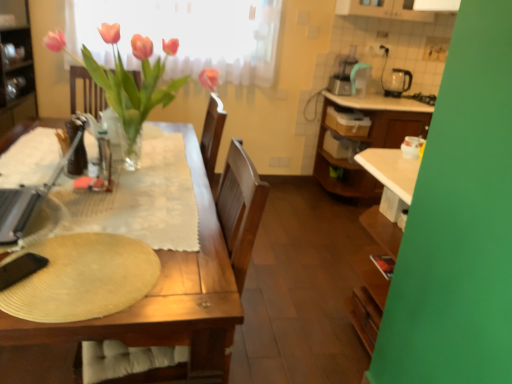
Question: From the image's perspective, is black plastic kettle at upper right, the first appliance positioned from the top, below translucent glass bottle at table left?

Choices:
 (A) yes
 (B) no

Answer: (B)

Question: From a real-world perspective, is black plastic kettle at upper right, which is the 2th appliance in bottom-to-top order, on translucent glass bottle at table left?

Choices:
 (A) yes
 (B) no

Answer: (A)

Question: Considering the relative sizes of black plastic kettle at upper right, arranged as the 1th appliance when viewed from the back, and translucent glass bottle at table left in the image provided, is black plastic kettle at upper right, arranged as the 1th appliance when viewed from the back, bigger than translucent glass bottle at table left?

Choices:
 (A) yes
 (B) no

Answer: (A)

Question: Would you say black plastic kettle at upper right, which is counted as the first appliance, starting from the right, contains translucent glass bottle at table left?

Choices:
 (A) no
 (B) yes

Answer: (A)

Question: Can you confirm if black plastic kettle at upper right, the 2th appliance when ordered from front to back, is thinner than translucent glass bottle at table left?

Choices:
 (A) yes
 (B) no

Answer: (B)

Question: From the image's perspective, would you say black plastic kettle at upper right, the second appliance positioned from the left, is positioned over translucent glass bottle at table left?

Choices:
 (A) no
 (B) yes

Answer: (B)

Question: From a real-world perspective, is translucent glass bottle at table left beneath metallic silver laptop at left, the 2th appliance when ordered from back to front?

Choices:
 (A) no
 (B) yes

Answer: (B)

Question: From a real-world perspective, is translucent glass bottle at table left on top of metallic silver laptop at left, marked as the second appliance in a top-to-bottom arrangement?

Choices:
 (A) no
 (B) yes

Answer: (A)

Question: Is translucent glass bottle at table left far away from metallic silver laptop at left, the first appliance from the bottom?

Choices:
 (A) yes
 (B) no

Answer: (B)

Question: Is the surface of translucent glass bottle at table left in direct contact with metallic silver laptop at left, the 2th appliance when ordered from back to front?

Choices:
 (A) no
 (B) yes

Answer: (A)

Question: Considering the relative sizes of translucent glass bottle at table left and metallic silver laptop at left, which is counted as the 1th appliance, starting from the left, in the image provided, is translucent glass bottle at table left shorter than metallic silver laptop at left, which is counted as the 1th appliance, starting from the left,?

Choices:
 (A) yes
 (B) no

Answer: (A)

Question: Does translucent glass bottle at table left have a greater width compared to metallic silver laptop at left, the first appliance from the bottom?

Choices:
 (A) no
 (B) yes

Answer: (A)

Question: Could you tell me if metallic silver laptop at left, which is counted as the second appliance, starting from the right, is facing beige textured paper plate at lower left?

Choices:
 (A) yes
 (B) no

Answer: (B)